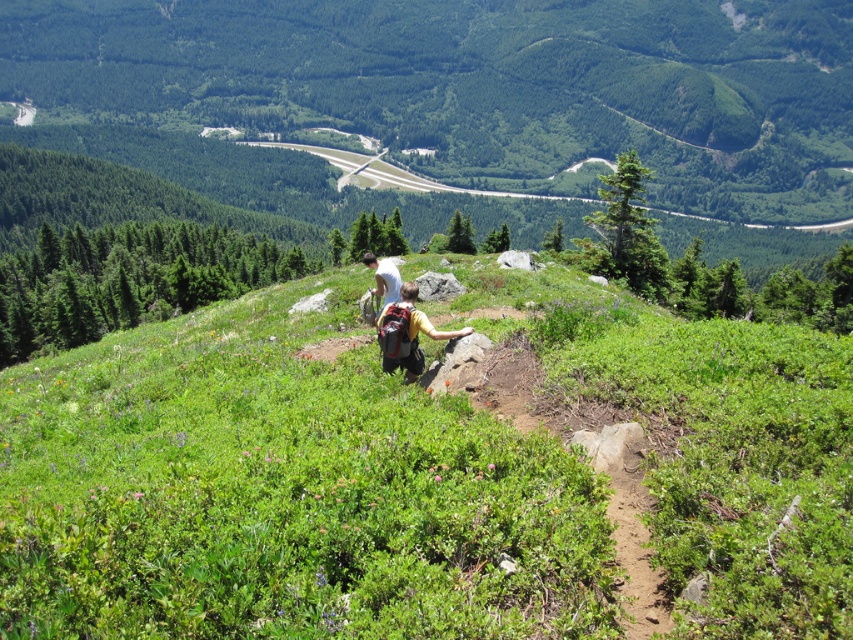
Is green leafy grass at center below matte yellow backpack at center?

Yes.

Does point (585, 634) lie in front of point (404, 337)?

Yes, point (585, 634) is closer to viewer.

Is point (425, 518) positioned after point (381, 321)?

No, (425, 518) is in front of (381, 321).

The height and width of the screenshot is (640, 853). Find the location of `green leafy grass at center`. green leafy grass at center is located at coordinates (279, 497).

Does green leafy grass at center have a smaller size compared to yellow fabric backpack at center?

Yes, green leafy grass at center is smaller than yellow fabric backpack at center.

Does green leafy grass at center come behind yellow fabric backpack at center?

No, it is in front of yellow fabric backpack at center.

Describe the element at coordinates (279, 497) in the screenshot. I see `green leafy grass at center` at that location.

Locate an element on the screen. Image resolution: width=853 pixels, height=640 pixels. green leafy grass at center is located at coordinates (279, 497).

Who is more forward, (390, 346) or (386, 296)?

Point (390, 346)

Between point (379, 339) and point (381, 296), which one is positioned behind?

The point (381, 296) is behind.

Measure the distance between matte yellow backpack at center and camera.

matte yellow backpack at center and camera are 15.92 meters apart from each other.

This screenshot has height=640, width=853. Find the location of `matte yellow backpack at center`. matte yellow backpack at center is located at coordinates (407, 333).